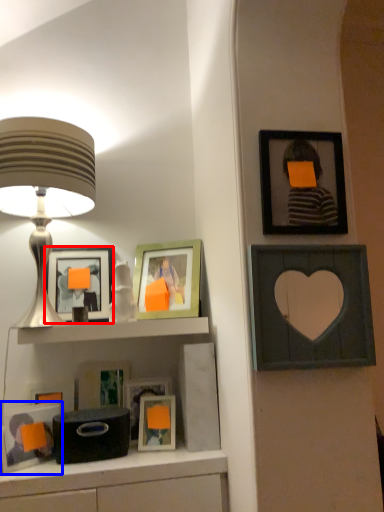
Question: Which of the following is the farthest to the observer, picture frame (highlighted by a red box) or picture frame (highlighted by a blue box)?

Choices:
 (A) picture frame
 (B) picture frame

Answer: (A)